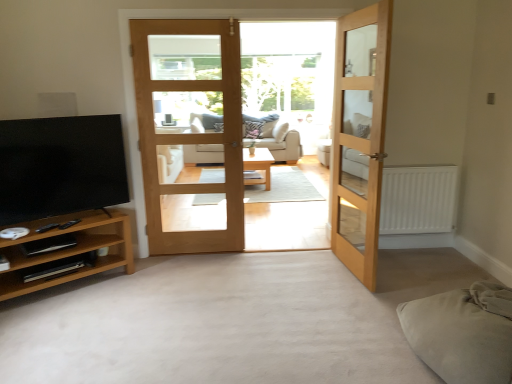
Question: Considering the positions of point (263, 165) and point (68, 135), is point (263, 165) closer or farther from the camera than point (68, 135)?

Choices:
 (A) closer
 (B) farther

Answer: (B)

Question: From the image's perspective, is light wood/finished table at center located above or below matte black tv at left?

Choices:
 (A) above
 (B) below

Answer: (A)

Question: Considering the real-world distances, which object is farthest from the light wood/finished table at center?

Choices:
 (A) beige fabric studio couch at center
 (B) light oak wooden door at center, the second door when ordered from right to left
 (C) brown wood tv stand at lower left
 (D) light brown wooden door at center, the second door positioned from the left
 (E) matte black tv at left

Answer: (C)

Question: Which object is positioned closest to the beige fabric studio couch at center?

Choices:
 (A) white matte radiator at right
 (B) light oak wooden door at center, marked as the 1th door in a left-to-right arrangement
 (C) clear glass door at center
 (D) matte black tv at left
 (E) light brown wooden door at center, the 1th door positioned from the right

Answer: (B)